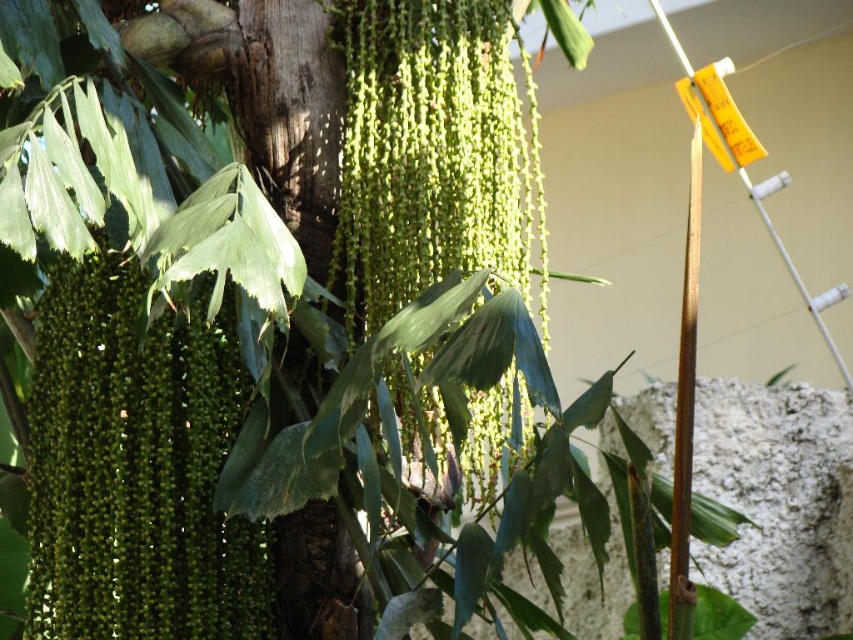
Can you confirm if green matte seeds at center is bigger than green textured tree trunk at center?

Yes.

Is green matte seeds at center to the right of green textured tree trunk at center from the viewer's perspective?

In fact, green matte seeds at center is to the left of green textured tree trunk at center.

Locate an element on the screen. green matte seeds at center is located at coordinates (136, 467).